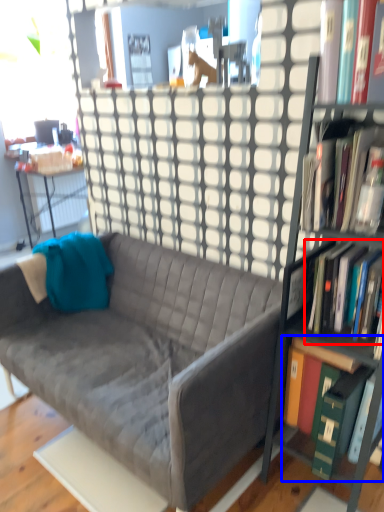
Question: Which object appears farthest to the camera in this image, book (highlighted by a red box) or book (highlighted by a blue box)?

Choices:
 (A) book
 (B) book

Answer: (B)